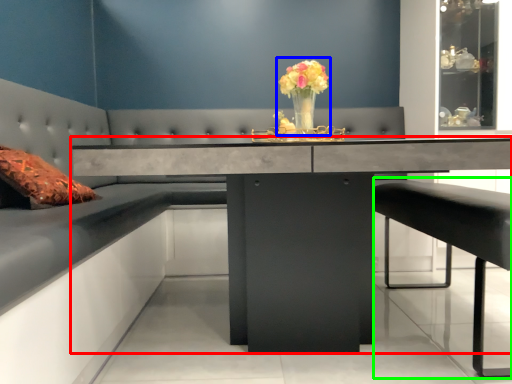
Question: Considering the real-world distances, which object is closest to table (highlighted by a red box)? floral arrangement (highlighted by a blue box) or bar stool (highlighted by a green box).

Choices:
 (A) floral arrangement
 (B) bar stool

Answer: (A)